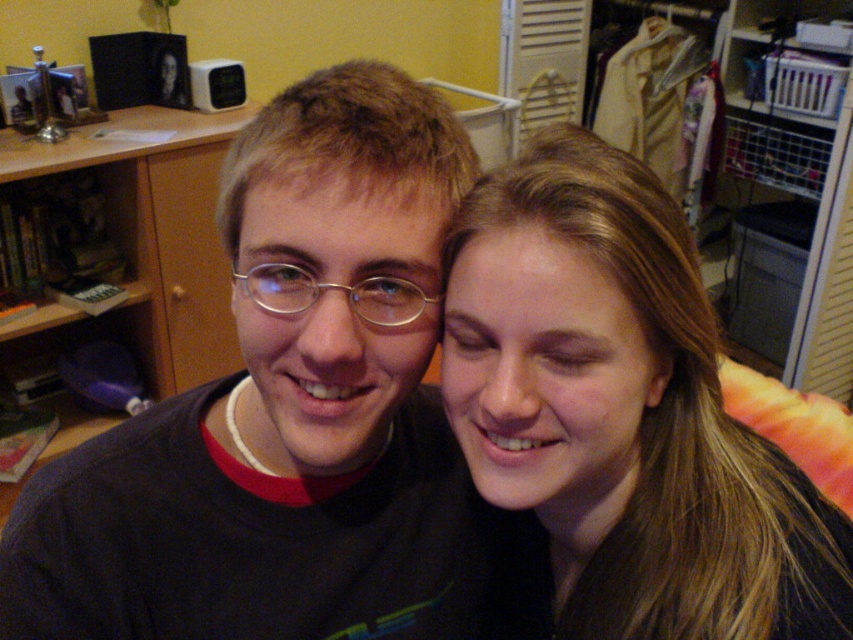
You are standing in the room and want to take a photo of the wooden bookshelf at left without the smooth brown hair at right appearing in the frame. How should you adjust your position?

Move to the left side of the room so that the wooden bookshelf at left is no longer blocked by the smooth brown hair at right, which is currently in front of it.

You are an interior designer assessing the layout of this room. You notice the smooth brown hair at right and the wooden bookshelf at left. Which object occupies more space in the room?

The wooden bookshelf at left occupies more space in the room because the smooth brown hair at right is thinner than it.